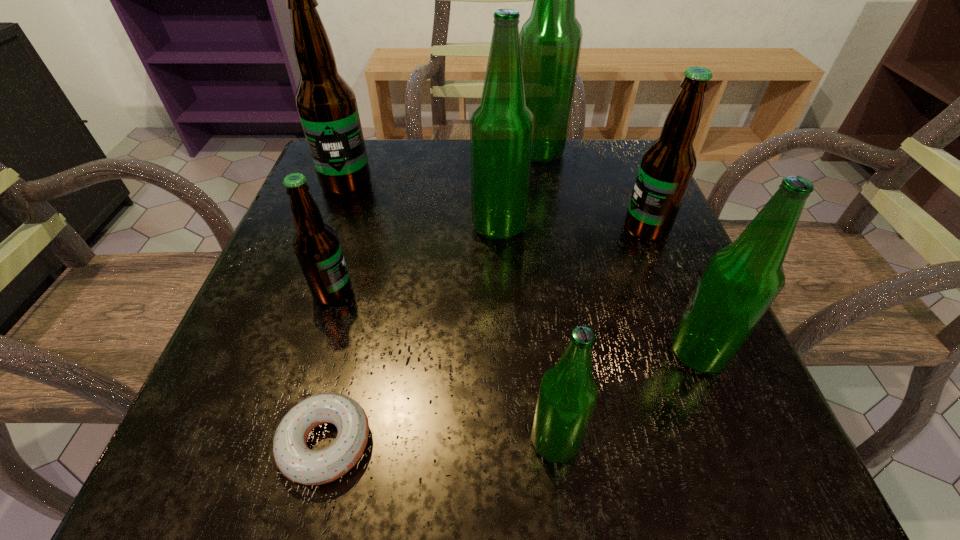
Find the location of `the tallest object`. the tallest object is located at coordinates (551, 38).

Find the location of `the farthest object`. the farthest object is located at coordinates (551, 38).

You are a GUI agent. You are given a task and a screenshot of the screen. Output one action in this format:
    pyautogui.click(x=<x>, y=<y>)
    Task: Click on the second farthest green beer bottle
    The height and width of the screenshot is (540, 960).
    Given the screenshot: What is the action you would take?
    pyautogui.click(x=502, y=127)

The height and width of the screenshot is (540, 960). I want to click on the sixth nearest beer bottle, so click(326, 104).

The height and width of the screenshot is (540, 960). I want to click on the biggest brown beer bottle, so click(x=326, y=104).

Where is `the rightmost brown beer bottle`? Image resolution: width=960 pixels, height=540 pixels. the rightmost brown beer bottle is located at coordinates (667, 166).

The height and width of the screenshot is (540, 960). I want to click on the second farthest brown beer bottle, so click(667, 166).

Image resolution: width=960 pixels, height=540 pixels. Find the location of `the rightmost green beer bottle`. the rightmost green beer bottle is located at coordinates [741, 281].

Locate an element on the screen. The width and height of the screenshot is (960, 540). the sixth farthest beer bottle is located at coordinates (741, 281).

I want to click on the nearest brown beer bottle, so click(316, 245).